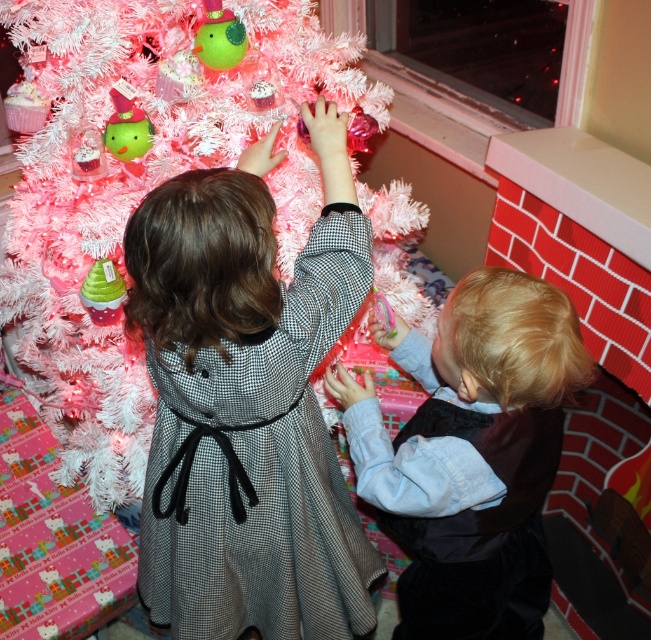
You are a parent standing in the room and want to ensure the safety of your children while they decorate the Christmas tree. The white tinsel christmas tree at upper left and the blonde hair at lower right are currently separated by a certain distance. Can you determine if the distance between them is sufficient to prevent the child with blonde hair from accidentally knocking over the tree?

The distance between the white tinsel christmas tree at upper left and the blonde hair at lower right is 66.76 centimeters. This distance is likely sufficient to prevent the child from accidentally knocking over the tree, as it provides a safe buffer between them.

Looking at this image, you are standing in front of the Christmas tree and want to place an ornament at point (46, 3). If your arm can reach up to 4 feet, will you be able to reach that point?

The distance of point (46, 3) from camera is 4.28 feet, so you cannot reach it since your arm can only extend up to 4 feet.

You are a photographer setting up a camera to capture the children decorating the Christmas tree. You need to ensure that both the matte gray dress at center and the blonde hair at lower right are fully visible in the frame. Given that the camera has a fixed width, which object should you position closer to the camera to maintain visibility without cropping?

Since the matte gray dress at center is wider than the blonde hair at lower right, you should position the matte gray dress at center closer to the camera. This will ensure both objects fit within the frame without cropping, as wider objects need to be closer to maintain visibility at the same scale.